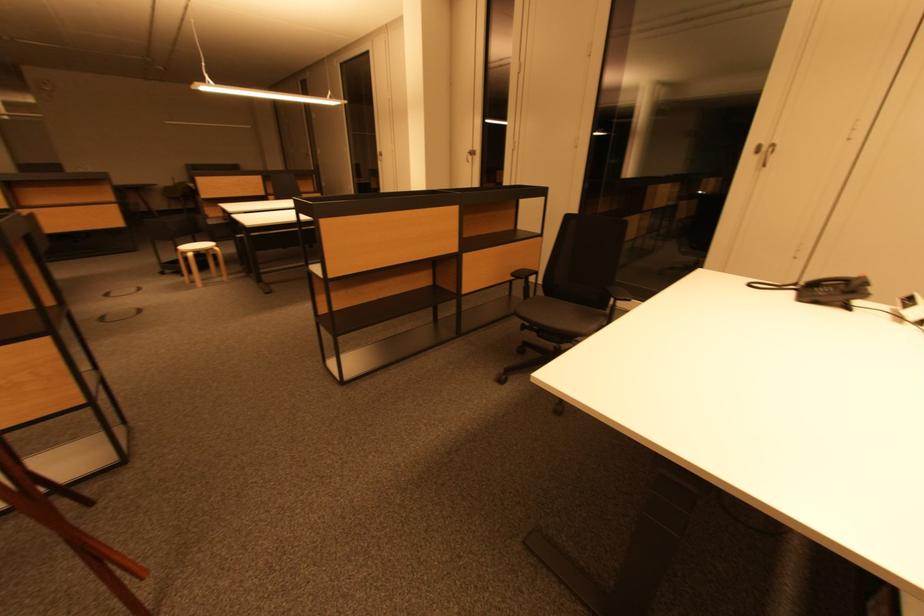
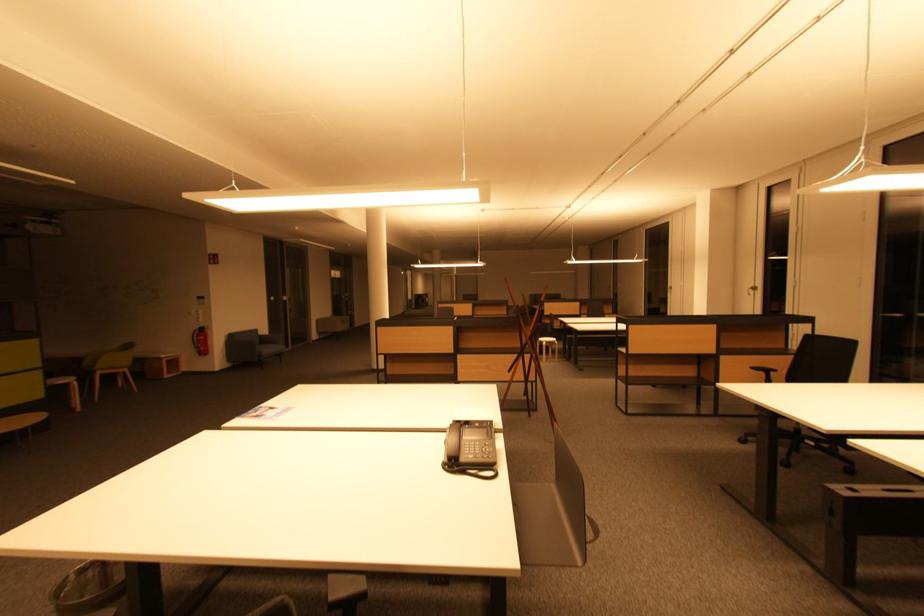
Question: I am providing you with two images of the same scene from different viewpoints. After the viewpoint changes to image2, which objects are now occluded?

Choices:
 (A) black chair sitting surface
 (B) metal stall lock
 (C) sofa armrest
 (D) wire mesh wastebasket

Answer: (A)